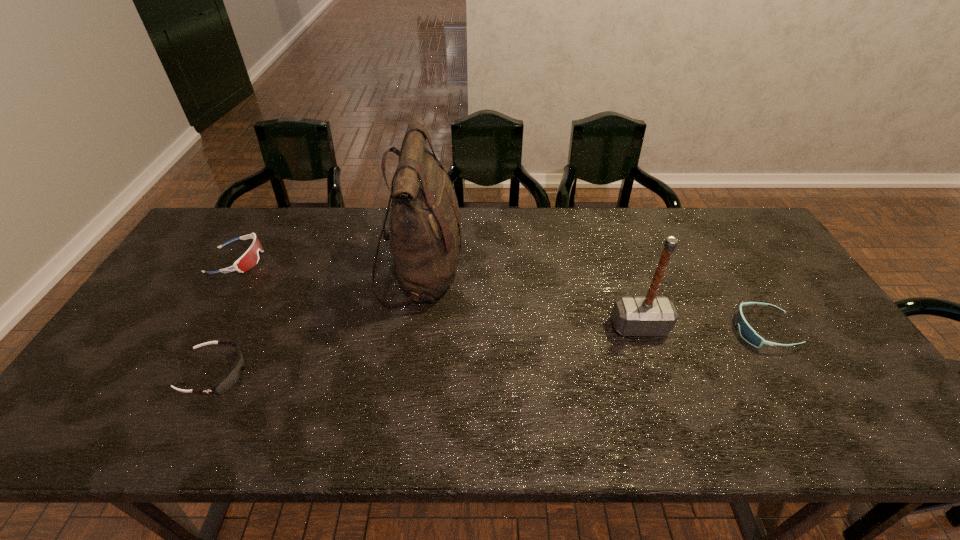
Identify the location of free region located on the front-facing side of the rightmost goggles. Image resolution: width=960 pixels, height=540 pixels. (667, 331).

This screenshot has height=540, width=960. I want to click on vacant space located on the front-facing side of the rightmost goggles, so click(689, 331).

Where is `vacant space located on the front-facing side of the rightmost goggles`? Image resolution: width=960 pixels, height=540 pixels. vacant space located on the front-facing side of the rightmost goggles is located at coordinates pos(626,331).

Where is `backpack present at the far edge`? This screenshot has width=960, height=540. backpack present at the far edge is located at coordinates 425,236.

Locate an element on the screen. This screenshot has height=540, width=960. goggles present at the far edge is located at coordinates (250, 258).

Find the location of `object at the left edge`. object at the left edge is located at coordinates (250, 258).

The width and height of the screenshot is (960, 540). Find the location of `object situated at the right edge`. object situated at the right edge is located at coordinates (746, 331).

Where is `object that is at the far left corner`? object that is at the far left corner is located at coordinates (250, 258).

This screenshot has width=960, height=540. I want to click on vacant region at the far edge of the desktop, so click(290, 221).

Find the location of a particular element. The height and width of the screenshot is (540, 960). vacant space at the near edge of the desktop is located at coordinates (507, 438).